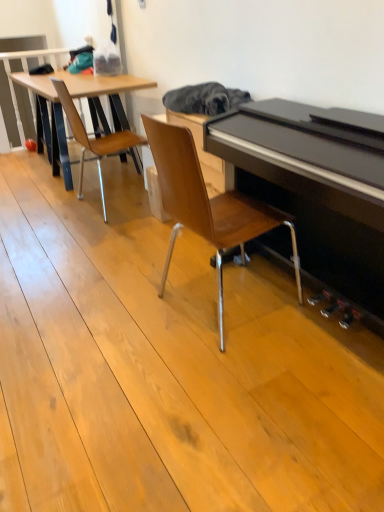
Find the location of a particular element. The width and height of the screenshot is (384, 512). vacant space underneath wooden chair at left, arranged as the second chair when viewed from the right (from a real-world perspective) is located at coordinates (107, 200).